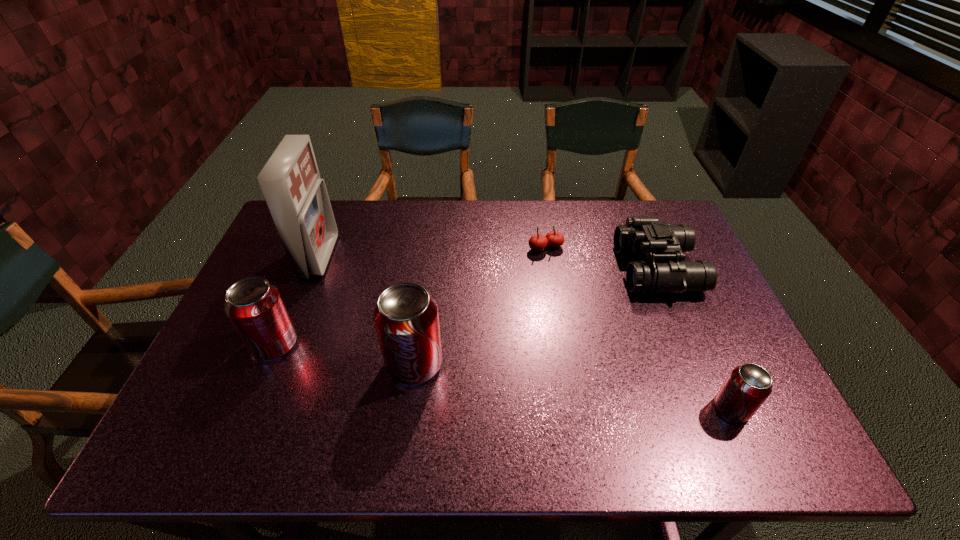
In the image, there is a desktop. Where is `vacant space at the right edge`? vacant space at the right edge is located at coordinates (713, 369).

Locate an element on the screen. vacant space at the far left corner of the desktop is located at coordinates (278, 244).

Find the location of a particular element. This screenshot has width=960, height=540. vacant space in between the leftmost soda can and the shortest soda can is located at coordinates (503, 376).

Identify the location of blank region between the third object from left to right and the tallest object. (367, 310).

Image resolution: width=960 pixels, height=540 pixels. What are the coordinates of `free spot between the third object from right to left and the third shortest object` in the screenshot? It's located at pyautogui.click(x=601, y=259).

Locate an element on the screen. empty location between the nearest soda can and the shortest object is located at coordinates (638, 328).

Image resolution: width=960 pixels, height=540 pixels. Identify the location of free space that is in between the fourth shortest object and the first-aid kit. (297, 300).

I want to click on free spot between the binoculars and the first-aid kit, so (x=489, y=263).

Find the location of a particular element. The width and height of the screenshot is (960, 540). free space between the shortest object and the second soda can from right to left is located at coordinates (480, 306).

Identify the location of free space between the fourth shortest object and the rightmost soda can. (503, 376).